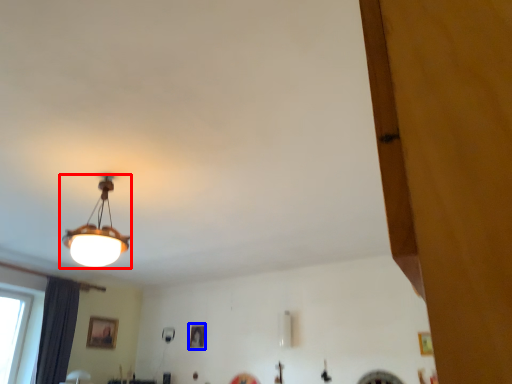
Question: Which object is closer to the camera taking this photo, lamp (highlighted by a red box) or picture frame (highlighted by a blue box)?

Choices:
 (A) lamp
 (B) picture frame

Answer: (A)